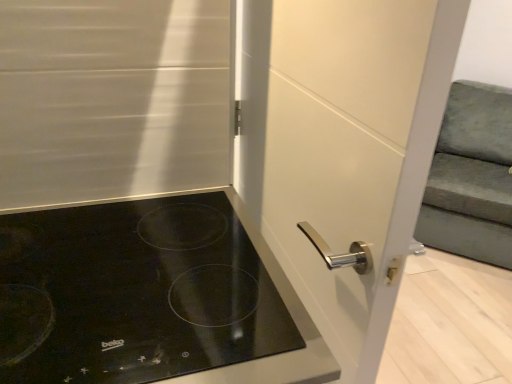
What do you see at coordinates (134, 293) in the screenshot? This screenshot has height=384, width=512. I see `black glass cooktop at lower left` at bounding box center [134, 293].

Where is `black glass cooktop at lower left`? black glass cooktop at lower left is located at coordinates (134, 293).

Can you confirm if black glass cooktop at lower left is taller than white glossy door handle at center?

No.

Is black glass cooktop at lower left bigger or smaller than white glossy door handle at center?

Clearly, black glass cooktop at lower left is smaller in size than white glossy door handle at center.

In the image, is black glass cooktop at lower left on the left side or the right side of white glossy door handle at center?

Based on their positions, black glass cooktop at lower left is located to the left of white glossy door handle at center.

Which is behind, point (112, 313) or point (471, 247)?

The point (471, 247) is farther.

Based on their positions, is black glass cooktop at lower left located to the left or right of velvet green armchair at right?

black glass cooktop at lower left is to the left of velvet green armchair at right.

From the image's perspective, which one is positioned higher, black glass cooktop at lower left or velvet green armchair at right?

From the image's view, velvet green armchair at right is above.

Can you confirm if white glossy door handle at center is shorter than velvet green armchair at right?

No.

Is white glossy door handle at center at the left side of velvet green armchair at right?

Yes, white glossy door handle at center is to the left of velvet green armchair at right.

Does white glossy door handle at center touch velvet green armchair at right?

There is a gap between white glossy door handle at center and velvet green armchair at right.

How far apart are white glossy door handle at center and velvet green armchair at right?

5.68 feet.

Which is in front, velvet green armchair at right or black glass cooktop at lower left?

Positioned in front is black glass cooktop at lower left.

Which is behind, point (483, 186) or point (17, 319)?

Positioned behind is point (483, 186).

Considering the relative sizes of white glossy door handle at center and black glass cooktop at lower left in the image provided, is white glossy door handle at center wider than black glass cooktop at lower left?

Incorrect, the width of white glossy door handle at center does not surpass that of black glass cooktop at lower left.

Is white glossy door handle at center next to black glass cooktop at lower left and touching it?

No, white glossy door handle at center is not with black glass cooktop at lower left.

How much distance is there between white glossy door handle at center and black glass cooktop at lower left?

They are 12.22 inches apart.

Is point (386, 163) closer or farther from the camera than point (151, 234)?

Point (386, 163) appears to be closer to the viewer than point (151, 234).

From a real-world perspective, is velvet green armchair at right physically above white glossy door handle at center?

Incorrect, from a real-world perspective, velvet green armchair at right is lower than white glossy door handle at center.

Considering the relative sizes of velvet green armchair at right and white glossy door handle at center in the image provided, is velvet green armchair at right bigger than white glossy door handle at center?

Correct, velvet green armchair at right is larger in size than white glossy door handle at center.

Which point is more forward, (474, 89) or (367, 97)?

The point (367, 97) is in front.

In order to click on armchair that is on the right side of white glossy door handle at center in this screenshot , I will do `click(471, 177)`.

Locate an element on the screen. This screenshot has height=384, width=512. gas stove below the white glossy door handle at center (from the image's perspective) is located at coordinates (134, 293).

Find the location of a particular element. Image resolution: width=512 pixels, height=384 pixels. armchair on the right of black glass cooktop at lower left is located at coordinates pyautogui.click(x=471, y=177).

Looking at the image, which one is located further to black glass cooktop at lower left, white glossy door handle at center or velvet green armchair at right?

Among the two, velvet green armchair at right is located further to black glass cooktop at lower left.

When comparing their distances from velvet green armchair at right, does white glossy door handle at center or black glass cooktop at lower left seem closer?

white glossy door handle at center is closer to velvet green armchair at right.

From the image, which object appears to be nearer to black glass cooktop at lower left, velvet green armchair at right or white glossy door handle at center?

white glossy door handle at center lies closer to black glass cooktop at lower left than the other object.

When comparing their distances from velvet green armchair at right, does black glass cooktop at lower left or white glossy door handle at center seem further?

black glass cooktop at lower left is further to velvet green armchair at right.

Considering their positions, is black glass cooktop at lower left positioned closer to white glossy door handle at center than velvet green armchair at right?

black glass cooktop at lower left lies closer to white glossy door handle at center than the other object.

Based on their spatial positions, is velvet green armchair at right or black glass cooktop at lower left closer to white glossy door handle at center?

black glass cooktop at lower left.

Locate an element on the screen. The height and width of the screenshot is (384, 512). screen door between black glass cooktop at lower left and velvet green armchair at right in the horizontal direction is located at coordinates pos(334,152).